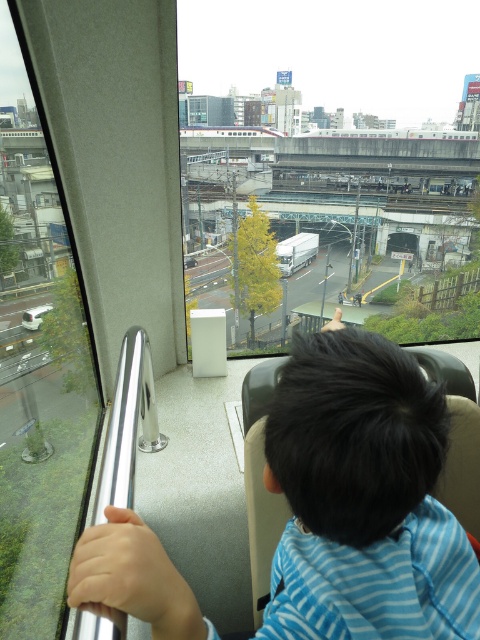
Between blue striped shirt at center and transparent glass train window at left, which one is positioned higher?

transparent glass train window at left is above.

Between point (160, 612) and point (82, 365), which one is positioned behind?

Positioned behind is point (82, 365).

Is point (364, 419) closer to viewer compared to point (1, 83)?

Yes, it is in front of point (1, 83).

The height and width of the screenshot is (640, 480). I want to click on blue striped shirt at center, so pyautogui.click(x=362, y=497).